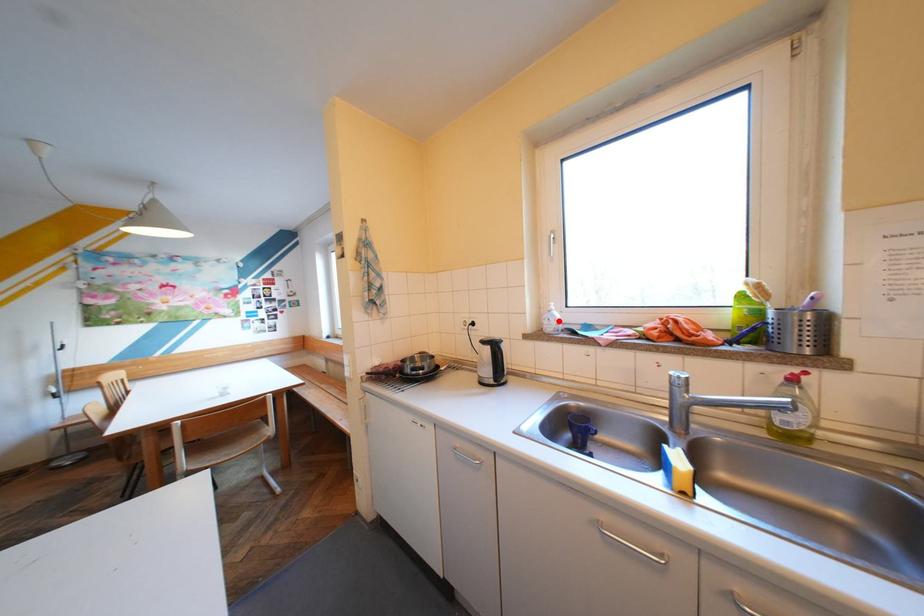
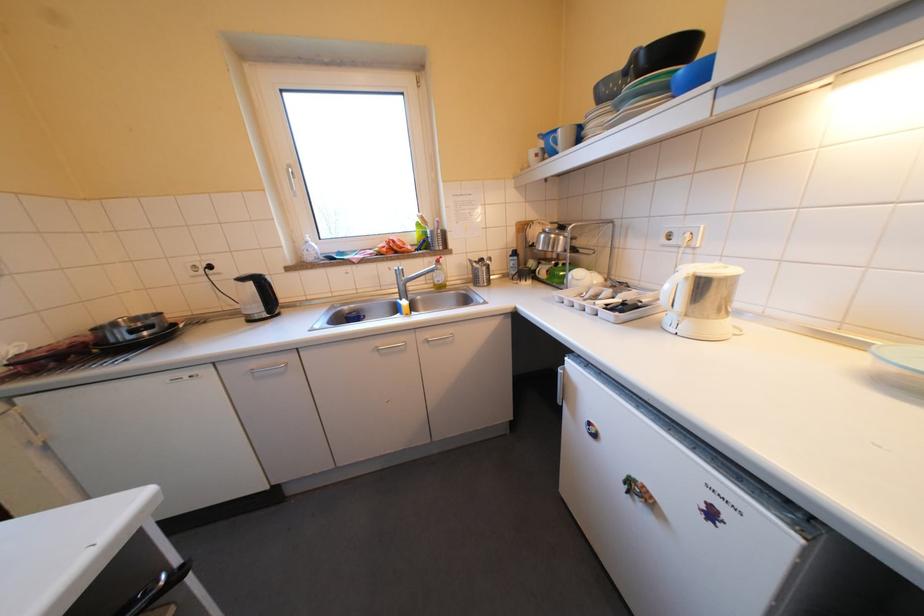
Where in the second image is the point corresponding to the highlighted location from the first image?

(319, 252)